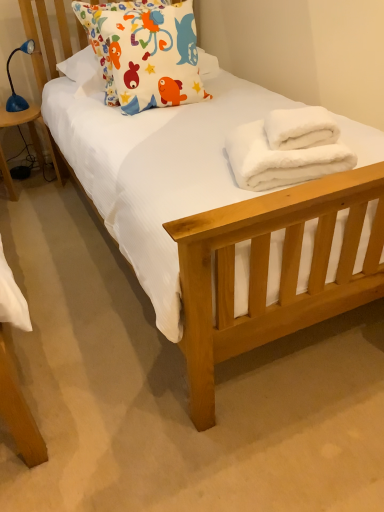
Question: Is white fluffy bath towel at center, the second bath towel positioned from the bottom, to the left or to the right of matte fabric pillow at upper left in the image?

Choices:
 (A) right
 (B) left

Answer: (A)

Question: From a real-world perspective, is white fluffy bath towel at center, the 1th bath towel in the top-to-bottom sequence, physically located above or below matte fabric pillow at upper left?

Choices:
 (A) above
 (B) below

Answer: (B)

Question: Estimate the real-world distances between objects in this image. Which object is farther from the matte fabric pillow at upper left?

Choices:
 (A) blue plastic lamp at left
 (B) white fluffy bath towel at center, the second bath towel positioned from the bottom
 (C) white fluffy bath towel at lower right, the first bath towel in the bottom-to-top sequence
 (D) blue plastic lamp at left

Answer: (A)

Question: Which is nearer to the white fluffy bath towel at center, the 1th bath towel in the top-to-bottom sequence?

Choices:
 (A) matte fabric pillow at upper left
 (B) blue plastic lamp at left
 (C) white fluffy bath towel at lower right, placed as the 2th bath towel when sorted from top to bottom
 (D) blue plastic lamp at left

Answer: (C)